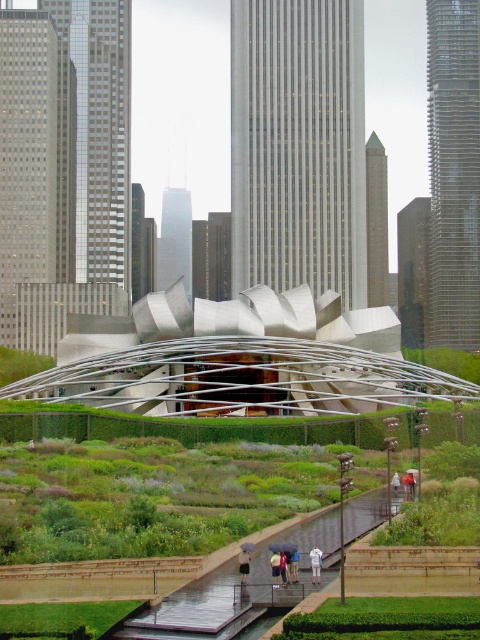
Question: Does white cotton umbrella at center lie in front of light blue fabric umbrella at center?

Choices:
 (A) no
 (B) yes

Answer: (A)

Question: Which object is the farthest from the white fabric person at center?

Choices:
 (A) white matte umbrella at center
 (B) white fabric umbrella at center

Answer: (B)

Question: Does light blue fabric umbrella at center have a larger size compared to blue fabric umbrella at center?

Choices:
 (A) yes
 (B) no

Answer: (B)

Question: Which of the following is the farthest from the observer?

Choices:
 (A) (443, 268)
 (B) (295, 566)
 (C) (295, 122)

Answer: (A)

Question: Among these points, which one is farthest from the camera?

Choices:
 (A) (279, 563)
 (B) (249, 560)

Answer: (B)

Question: Can you confirm if light blue fabric umbrella at center is thinner than blue fabric umbrella at center?

Choices:
 (A) no
 (B) yes

Answer: (B)